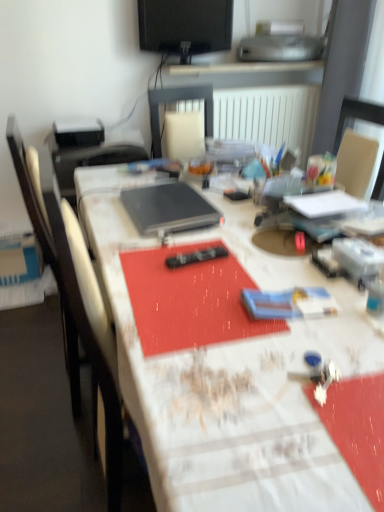
Image resolution: width=384 pixels, height=512 pixels. Find the location of `blank space to the left of black plastic remote control at center`. blank space to the left of black plastic remote control at center is located at coordinates (138, 259).